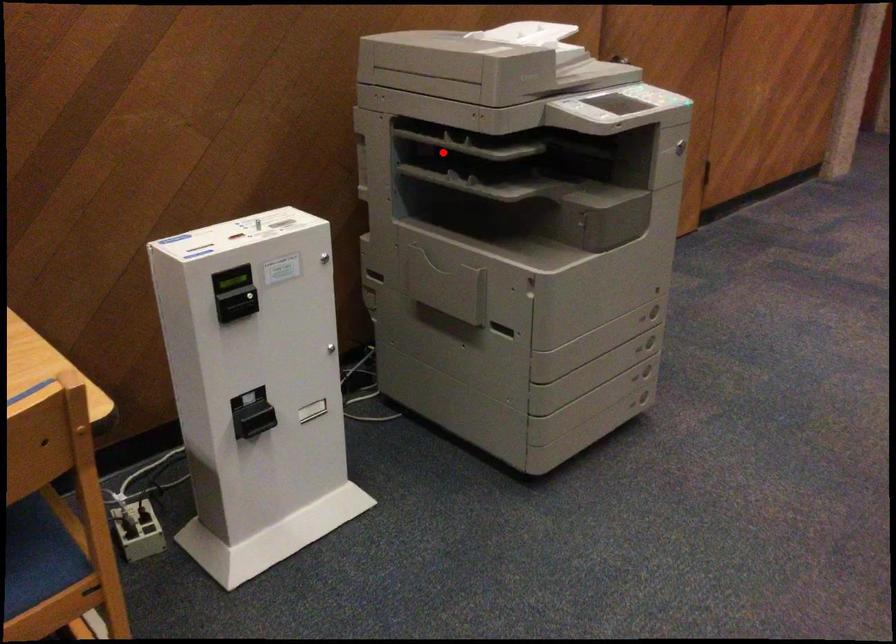
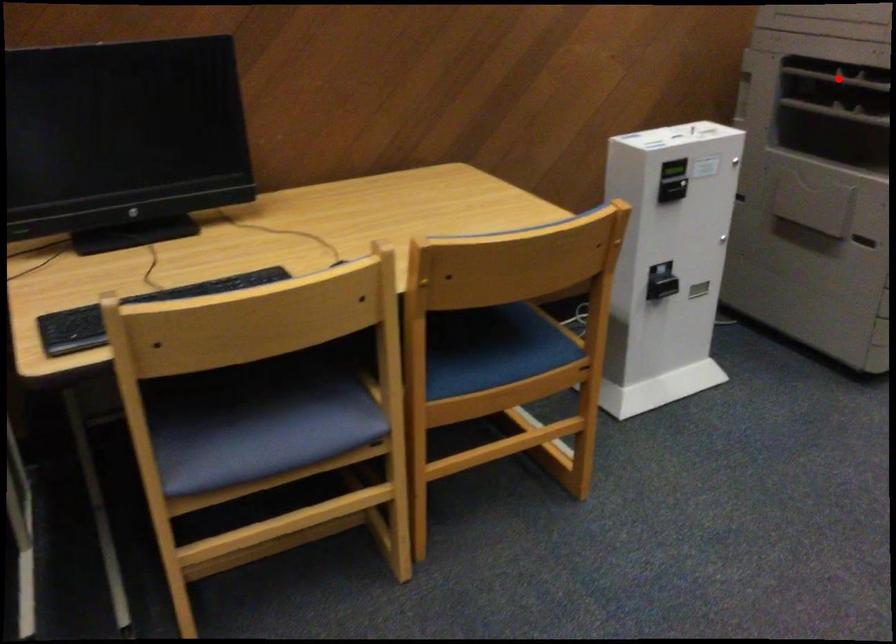
I am providing you with two images of the same scene from different viewpoints. A red point is marked on the first image and another point is marked on the second image. Is the red point in image1 aligned with the point shown in image2?

Yes